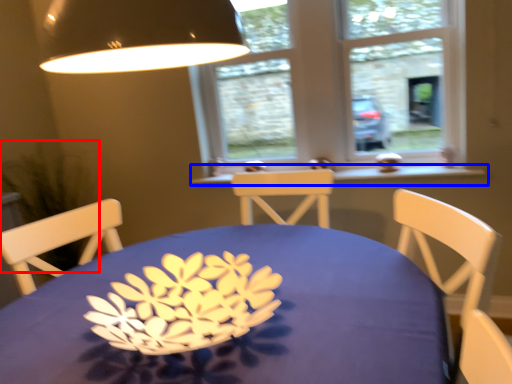
Question: Which point is further to the camera, plant (highlighted by a red box) or window sill (highlighted by a blue box)?

Choices:
 (A) plant
 (B) window sill

Answer: (B)